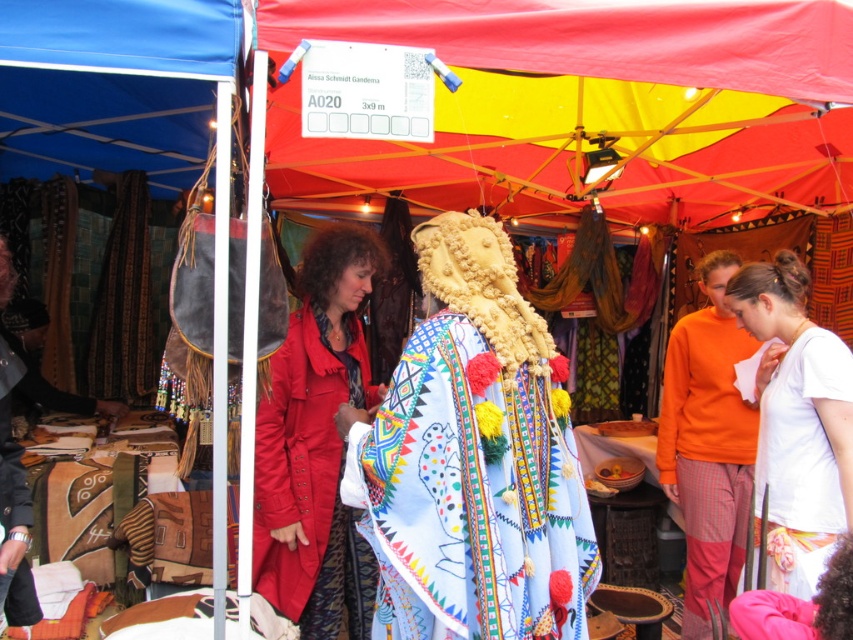
Can you confirm if orange cotton sweater at right is wider than matte black jacket at left?

Yes, orange cotton sweater at right is wider than matte black jacket at left.

Who is more distant from viewer, (700,339) or (4,380)?

Positioned behind is point (700,339).

The image size is (853, 640). What do you see at coordinates (706, 454) in the screenshot? I see `orange cotton sweater at right` at bounding box center [706, 454].

Where is `orange cotton sweater at right`? The width and height of the screenshot is (853, 640). orange cotton sweater at right is located at coordinates (706, 454).

Is matte red coat at center wider than matte black jacket at left?

Correct, the width of matte red coat at center exceeds that of matte black jacket at left.

Who is taller, matte red coat at center or matte black jacket at left?

Standing taller between the two is matte red coat at center.

Describe the element at coordinates (316, 444) in the screenshot. This screenshot has width=853, height=640. I see `matte red coat at center` at that location.

Identify the location of matte red coat at center. (316, 444).

Consider the image. Who is lower down, red fabric canopy at upper center or matte red coat at center?

matte red coat at center is below.

Can you confirm if red fabric canopy at upper center is thinner than matte red coat at center?

No, red fabric canopy at upper center is not thinner than matte red coat at center.

Identify the location of red fabric canopy at upper center. The width and height of the screenshot is (853, 640). (581, 108).

Where is `red fabric canopy at upper center`? This screenshot has height=640, width=853. red fabric canopy at upper center is located at coordinates (581, 108).